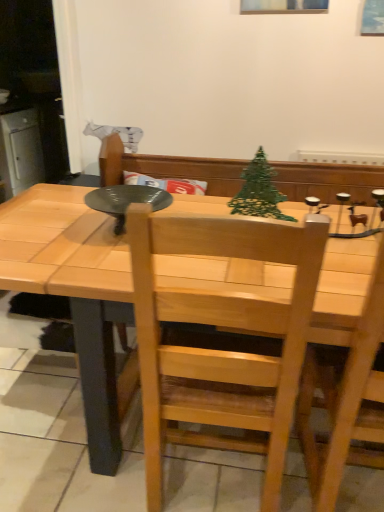
Question: From the image's perspective, relative to natural wood chair at center, is natural wood table at center above or below?

Choices:
 (A) above
 (B) below

Answer: (A)

Question: From a real-world perspective, is natural wood table at center positioned above or below natural wood chair at center?

Choices:
 (A) below
 (B) above

Answer: (A)

Question: Estimate the real-world distances between objects in this image. Which object is closer to the natural wood chair at center?

Choices:
 (A) green wire christmas tree at center
 (B) natural wood table at center

Answer: (B)

Question: Which object is positioned farthest from the green wire christmas tree at center?

Choices:
 (A) natural wood table at center
 (B) natural wood chair at center

Answer: (B)